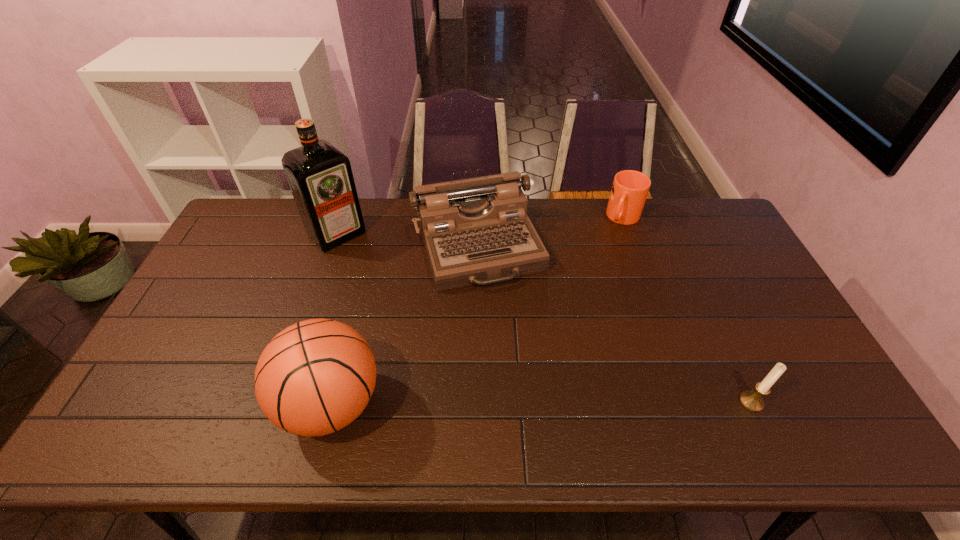
You are a GUI agent. You are given a task and a screenshot of the screen. Output one action in this format:
    pyautogui.click(x=<x>, y=<y>)
    Task: Click on the basketball located at the near edge
    This screenshot has width=960, height=540.
    Given the screenshot: What is the action you would take?
    pyautogui.click(x=315, y=377)

Image resolution: width=960 pixels, height=540 pixels. I want to click on candle holder that is at the near edge, so click(x=751, y=400).

The width and height of the screenshot is (960, 540). I want to click on free space at the far edge of the desktop, so click(x=545, y=204).

The height and width of the screenshot is (540, 960). In the image, there is a desktop. What are the coordinates of `free region at the near edge` in the screenshot? It's located at (636, 381).

The image size is (960, 540). In the image, there is a desktop. What are the coordinates of `blank space at the left edge` in the screenshot? It's located at (155, 374).

This screenshot has width=960, height=540. Identify the location of free location at the far left corner. (280, 205).

Locate an element on the screen. The width and height of the screenshot is (960, 540). vacant area that lies between the candle holder and the tallest object is located at coordinates (544, 318).

Where is `vacant area between the liquor and the basketball`? vacant area between the liquor and the basketball is located at coordinates (334, 319).

Locate an element on the screen. The width and height of the screenshot is (960, 540). free space between the candle holder and the third object from right to left is located at coordinates (614, 323).

The image size is (960, 540). In order to click on vacant space in between the candle holder and the second object from right to left in this screenshot , I will do `click(687, 310)`.